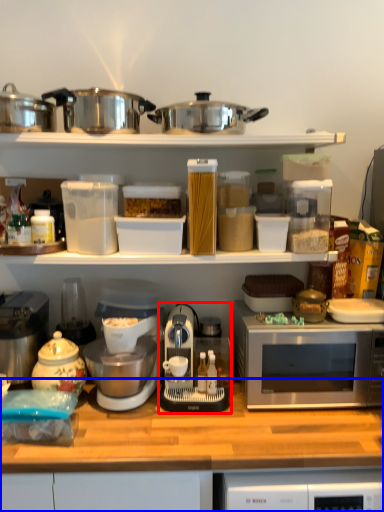
Question: Which object is closer to the camera taking this photo, appliance (highlighted by a red box) or countertop (highlighted by a blue box)?

Choices:
 (A) appliance
 (B) countertop

Answer: (B)